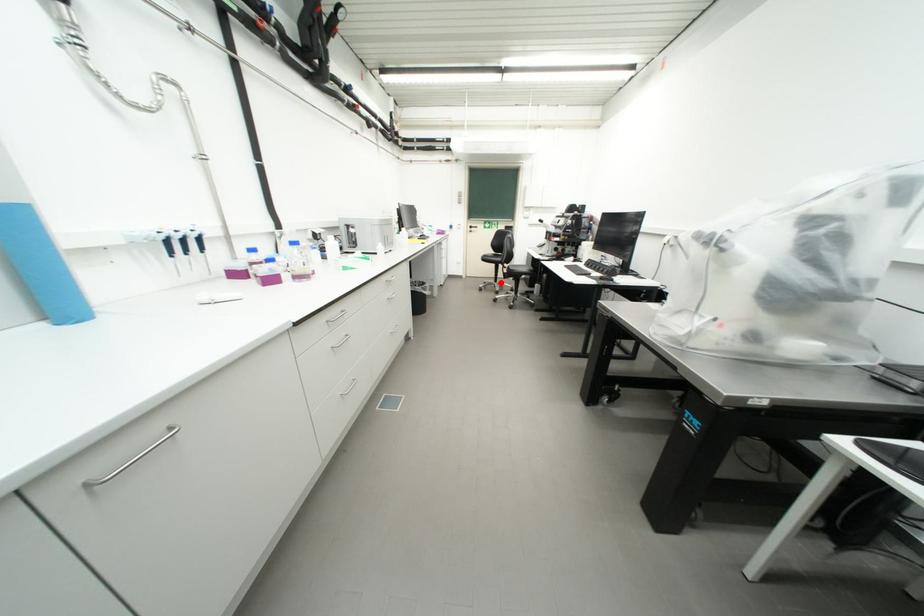
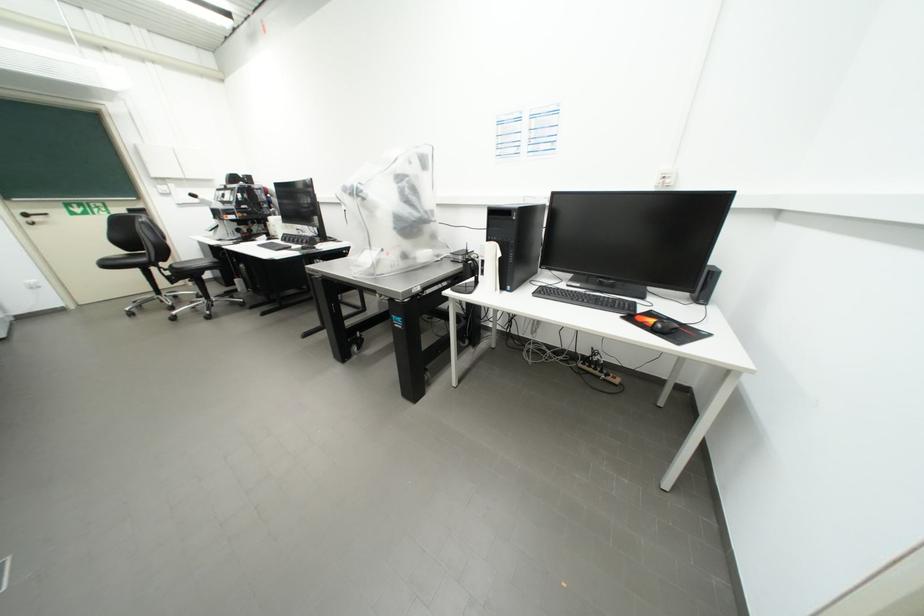
Find the pixel in the second image that matches the highlighted location in the first image.

(160, 296)